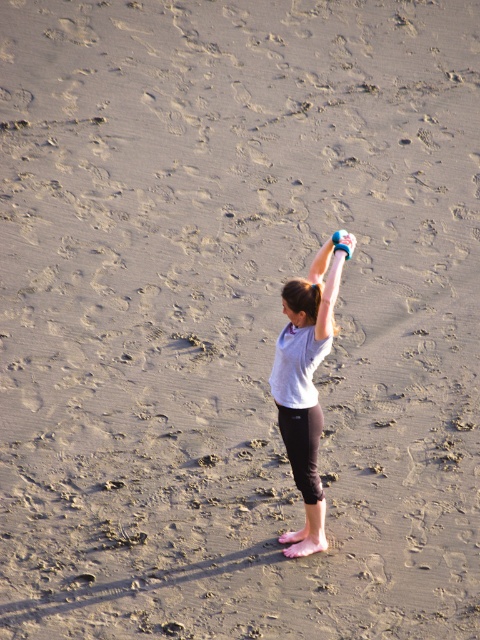
Question: Which object is closer to the camera taking this photo?

Choices:
 (A) blue rubber glove at upper center
 (B) smooth blue dumbbell at upper right
 (C) blue rubber band at upper center

Answer: (B)

Question: Among these points, which one is farthest from the camera?

Choices:
 (A) (323, 253)
 (B) (316, 355)
 (C) (316, 328)
 (D) (342, 237)

Answer: (A)

Question: Considering the real-world distances, which object is farthest from the gray fabric shirt at center?

Choices:
 (A) blue rubber band at upper center
 (B) blue rubber glove at upper center

Answer: (B)

Question: In this image, where is smooth blue dumbbell at upper right located relative to blue rubber band at upper center?

Choices:
 (A) left
 (B) right

Answer: (B)

Question: Can you confirm if gray fabric shirt at center is positioned to the left of blue rubber band at upper center?

Choices:
 (A) yes
 (B) no

Answer: (A)

Question: Is the position of smooth blue dumbbell at upper right more distant than that of blue rubber band at upper center?

Choices:
 (A) no
 (B) yes

Answer: (A)